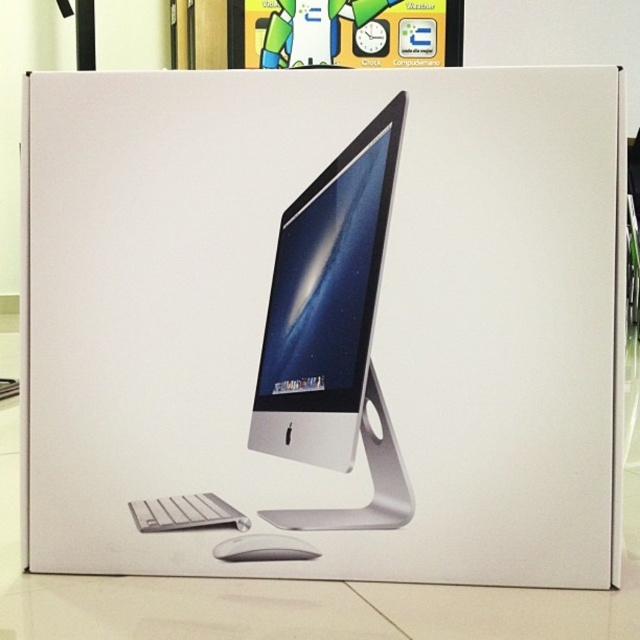
Question: Which of the following is the farthest from the observer?

Choices:
 (A) (371, 168)
 (B) (253, 547)
 (C) (164, 506)

Answer: (C)

Question: Where is silver metallic computer monitor at center located in relation to white plastic keyboard at lower left in the image?

Choices:
 (A) left
 (B) right

Answer: (B)

Question: Which of the following is the farthest from the observer?

Choices:
 (A) (211, 520)
 (B) (400, 118)

Answer: (A)

Question: Which point is farther from the camera taking this photo?

Choices:
 (A) (221, 554)
 (B) (180, 497)
 (C) (340, 305)

Answer: (B)

Question: Is white plastic keyboard at lower left to the right of white matte mouse at lower center from the viewer's perspective?

Choices:
 (A) yes
 (B) no

Answer: (B)

Question: Is silver metallic computer monitor at center positioned in front of white plastic keyboard at lower left?

Choices:
 (A) no
 (B) yes

Answer: (B)